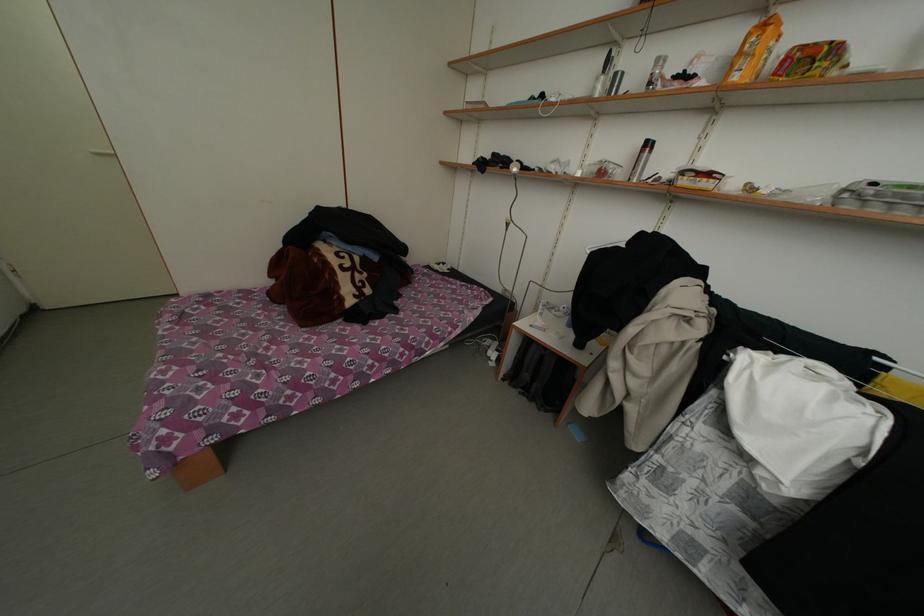
Locate an element on the screen. white cabinet handle is located at coordinates (102, 151).